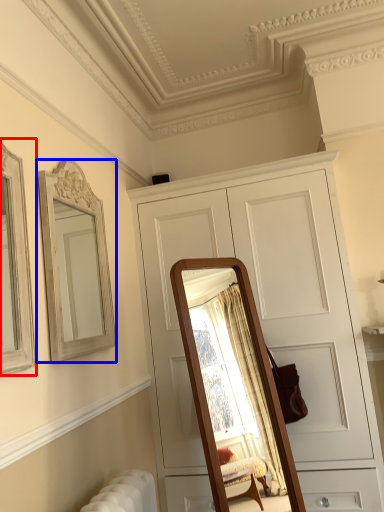
Question: Which object is further to the camera taking this photo, picture frame (highlighted by a red box) or mirror (highlighted by a blue box)?

Choices:
 (A) picture frame
 (B) mirror

Answer: (B)